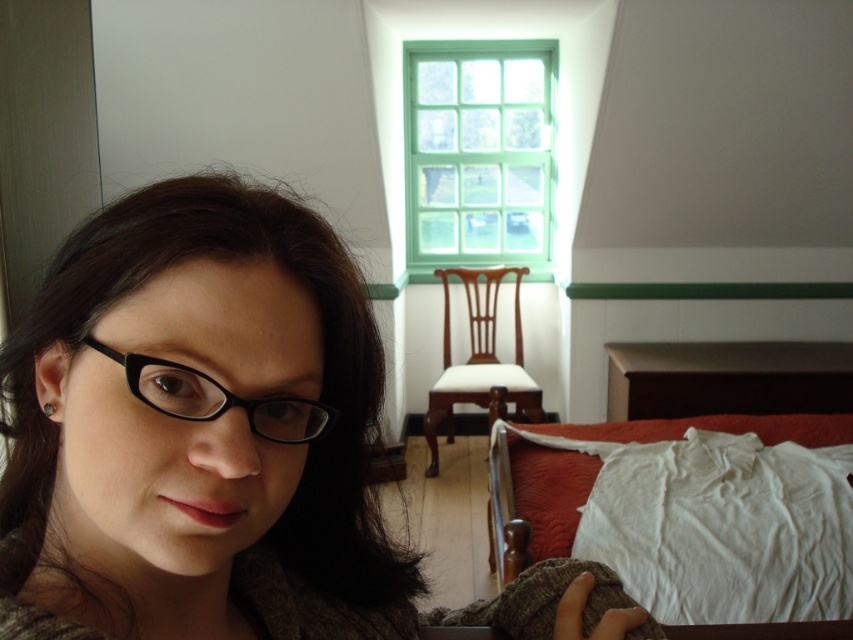
Question: Does matte black glasses at left have a smaller size compared to wooden chair at center?

Choices:
 (A) no
 (B) yes

Answer: (B)

Question: Among these objects, which one is nearest to the camera?

Choices:
 (A) white cotton bed at lower right
 (B) matte black glasses at left

Answer: (B)

Question: Is matte black glasses at left positioned in front of white cotton bed at lower right?

Choices:
 (A) no
 (B) yes

Answer: (B)

Question: Which object is farther from the camera taking this photo?

Choices:
 (A) matte black glasses at left
 (B) black plastic glasses at left

Answer: (B)

Question: Does matte black glasses at left have a lesser width compared to green painted wood window at upper center?

Choices:
 (A) yes
 (B) no

Answer: (A)

Question: Which of the following is the closest to the observer?

Choices:
 (A) (495, 566)
 (B) (456, 156)

Answer: (A)